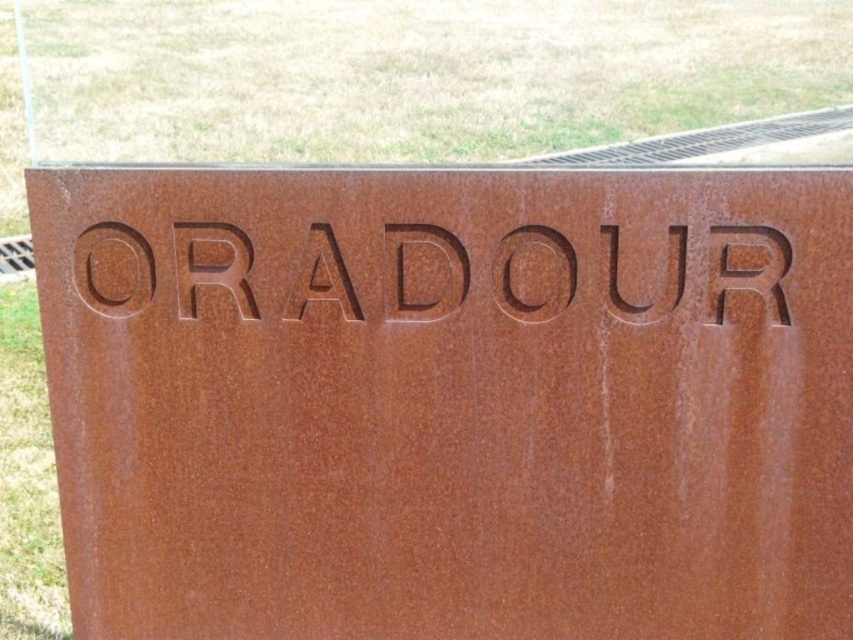
Which is behind, point (381, 611) or point (439, 35)?

The point (439, 35) is behind.

Consider the image. Does rusty metal sign at center have a greater width compared to brown grass at upper center?

In fact, rusty metal sign at center might be narrower than brown grass at upper center.

Identify the location of rusty metal sign at center. (450, 403).

The width and height of the screenshot is (853, 640). Identify the location of rusty metal sign at center. (450, 403).